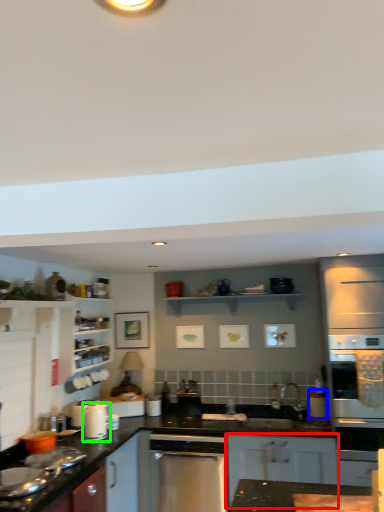
Question: Based on their relative distances, which object is nearer to cabinetry (highlighted by a red box)? Choose from appliance (highlighted by a blue box) and kitchen appliance (highlighted by a green box).

Choices:
 (A) appliance
 (B) kitchen appliance

Answer: (A)